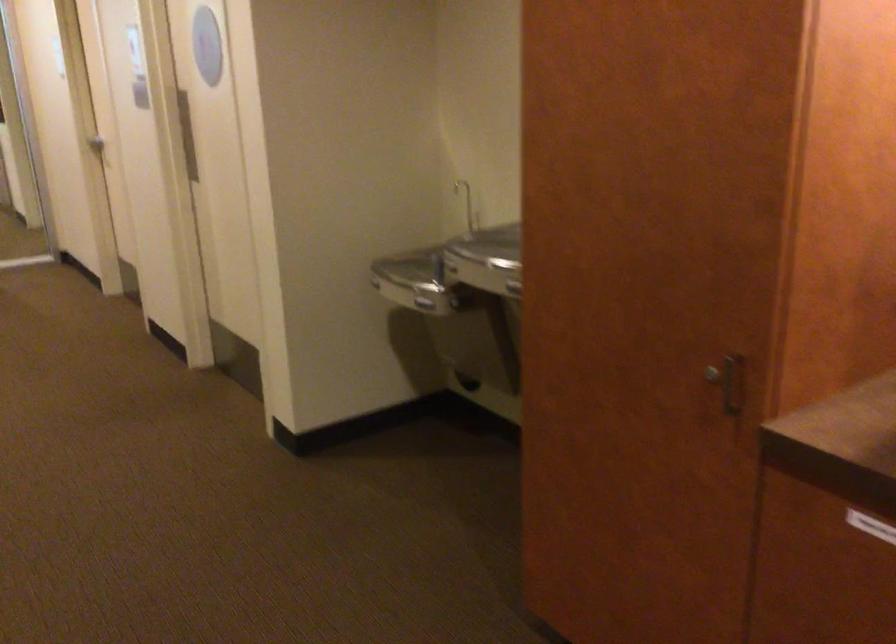
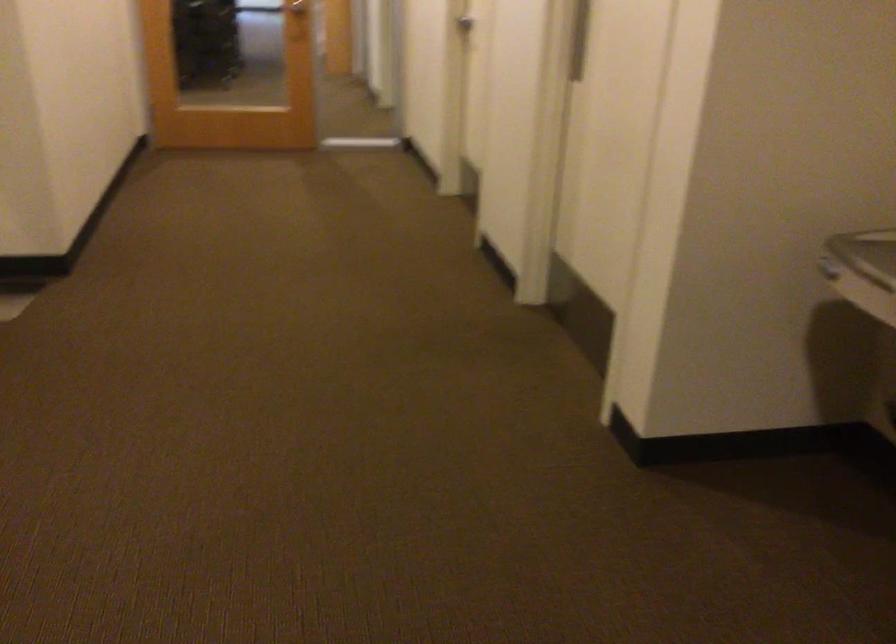
From the picture: What movement of the cameraman would produce the second image?

The cameraman walked toward left, forward.